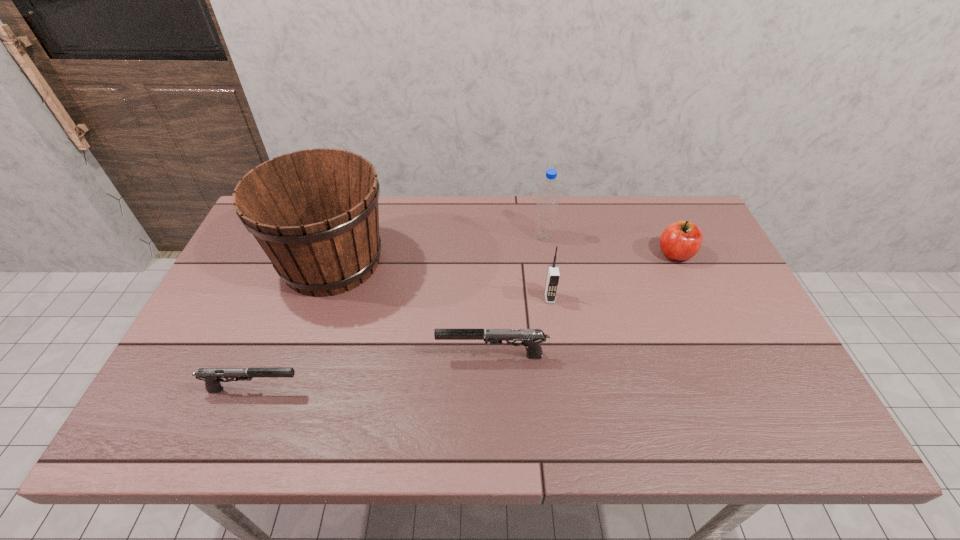
Find the location of a particular element. The image size is (960, 540). vacant space that is in between the left gun and the farther gun is located at coordinates (372, 373).

Locate an element on the screen. free area in between the water bottle and the wine bucket is located at coordinates (438, 249).

The width and height of the screenshot is (960, 540). What are the coordinates of `free area in between the taller gun and the fourth shortest object` in the screenshot? It's located at 521,327.

Locate an element on the screen. The image size is (960, 540). free space between the farther gun and the wine bucket is located at coordinates (412, 309).

Find the location of a particular element. The height and width of the screenshot is (540, 960). empty location between the third object from left to right and the wine bucket is located at coordinates (412, 309).

Image resolution: width=960 pixels, height=540 pixels. Identify the location of vacant space that is in between the nearer gun and the rightmost object. (465, 321).

Where is `free space that is in between the water bottle and the apple`? The width and height of the screenshot is (960, 540). free space that is in between the water bottle and the apple is located at coordinates (610, 245).

Where is `free space between the shortest object and the water bottle`? Image resolution: width=960 pixels, height=540 pixels. free space between the shortest object and the water bottle is located at coordinates (398, 313).

Locate an element on the screen. free space between the water bottle and the shorter gun is located at coordinates (398, 313).

I want to click on the closest object relative to the rightmost object, so click(x=547, y=203).